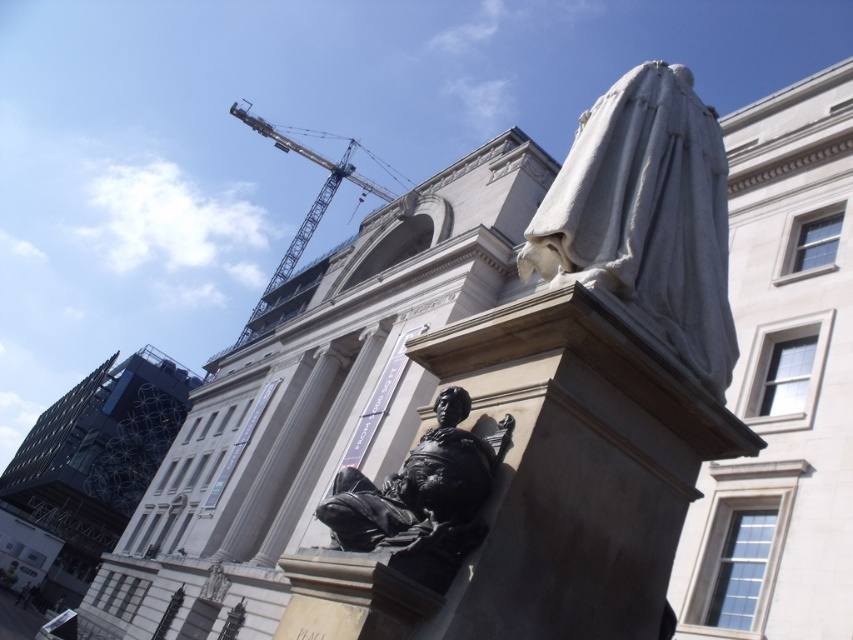
From the picture: You are an art student analyzing the urban scene. You notice the white marble statue at upper right and the black polished statue at lower center. Which statue is positioned higher in the image?

The white marble statue at upper right is positioned higher than the black polished statue at lower center.

You are an art student analyzing the urban scene. You notice the white marble statue at upper right and the black polished statue at lower center. Which statue is taller?

The white marble statue at upper right is taller than the black polished statue at lower center according to the description.

You are an architect designing a new public square. You need to ensure that the black polished statue at lower center and the yellow metallic crane at upper center are visible from a central viewing point. Given their heights, which object will appear taller when viewed from this central point?

The yellow metallic crane at upper center will appear taller than the black polished statue at lower center because the description states that the black polished statue at lower center is shorter than the yellow metallic crane at upper center.